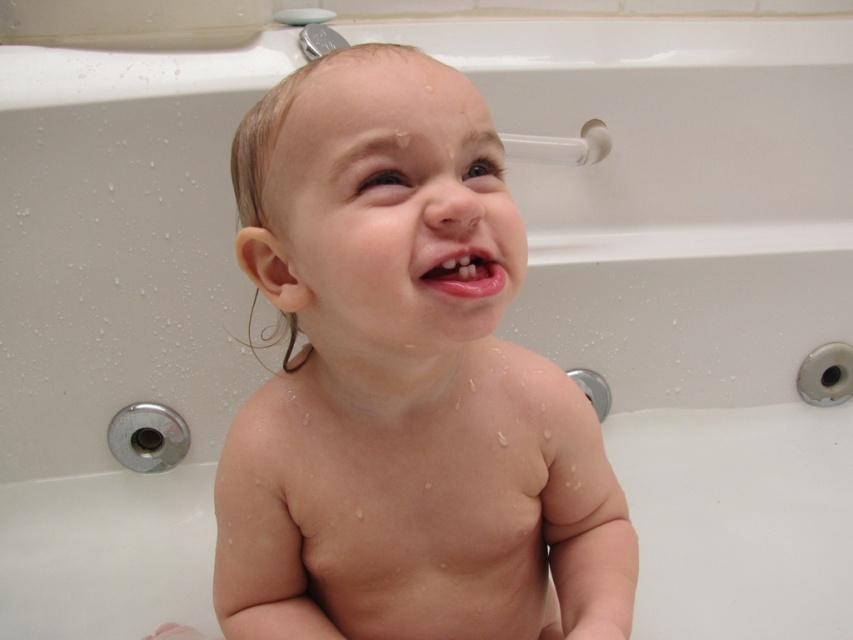
Between smooth skin baby at center and pink glossy lips at center, which one is positioned lower?

smooth skin baby at center

Which of these two, smooth skin baby at center or pink glossy lips at center, stands shorter?

Standing shorter between the two is pink glossy lips at center.

Who is more distant from viewer, (332, 321) or (492, 292)?

The point (332, 321) is behind.

This screenshot has height=640, width=853. In order to click on smooth skin baby at center in this screenshot , I will do `click(402, 387)`.